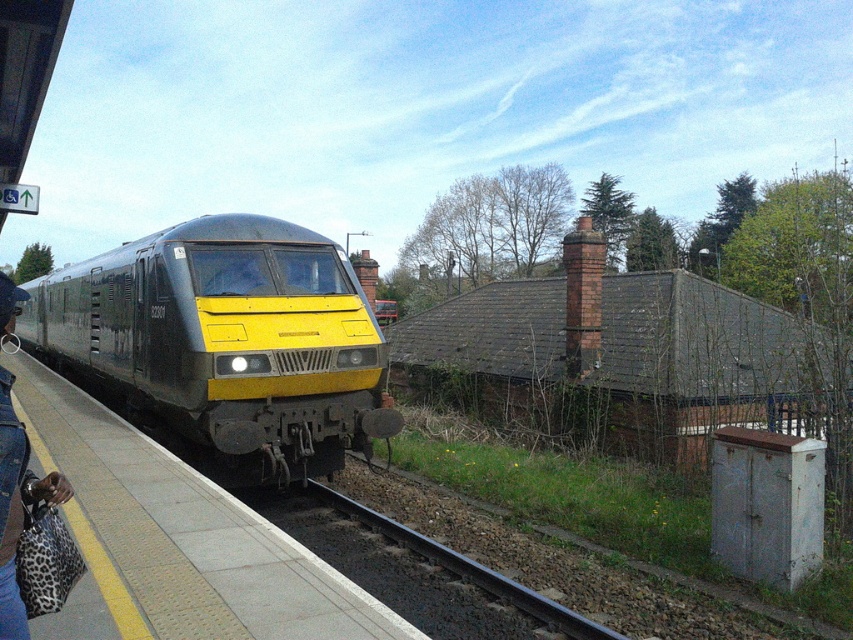
Can you confirm if metallic yellow train at center is thinner than concrete platform at center?

No, metallic yellow train at center is not thinner than concrete platform at center.

Does metallic yellow train at center appear under concrete platform at center?

Incorrect, metallic yellow train at center is not positioned below concrete platform at center.

The image size is (853, 640). What are the coordinates of `metallic yellow train at center` in the screenshot? It's located at (225, 340).

Where is `metallic yellow train at center`? metallic yellow train at center is located at coordinates (225, 340).

Is metallic yellow train at center wider than black gravel train track at lower center?

Correct, the width of metallic yellow train at center exceeds that of black gravel train track at lower center.

Is metallic yellow train at center to the left of black gravel train track at lower center from the viewer's perspective?

Yes, metallic yellow train at center is to the left of black gravel train track at lower center.

In order to click on metallic yellow train at center in this screenshot , I will do `click(225, 340)`.

Where is `metallic yellow train at center`? metallic yellow train at center is located at coordinates (225, 340).

Does metallic yellow train at center have a smaller size compared to leopard print bag at platform left?

Incorrect, metallic yellow train at center is not smaller in size than leopard print bag at platform left.

Does metallic yellow train at center have a greater height compared to leopard print bag at platform left?

Correct, metallic yellow train at center is much taller as leopard print bag at platform left.

Which is behind, point (312, 422) or point (15, 552)?

Positioned behind is point (312, 422).

Image resolution: width=853 pixels, height=640 pixels. Find the location of `metallic yellow train at center`. metallic yellow train at center is located at coordinates (225, 340).